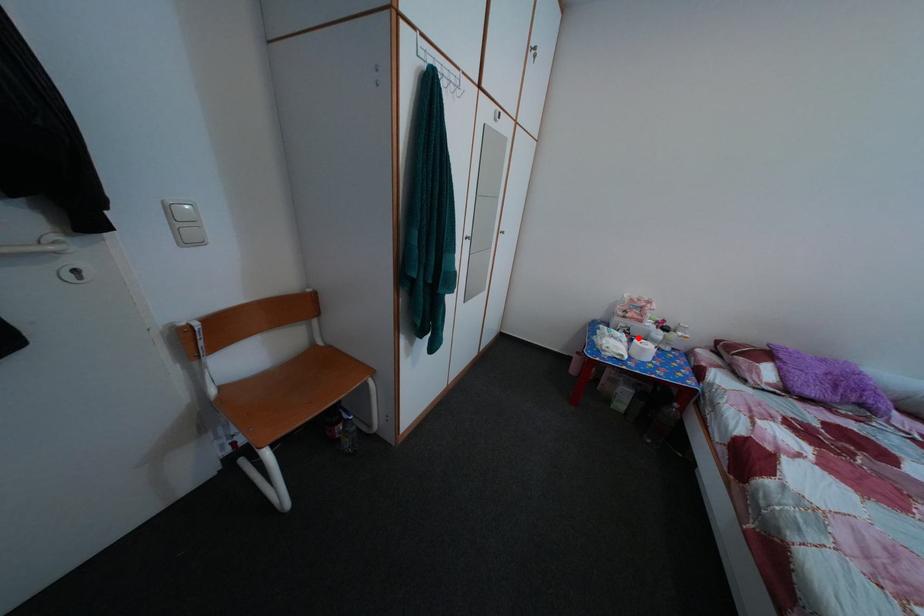
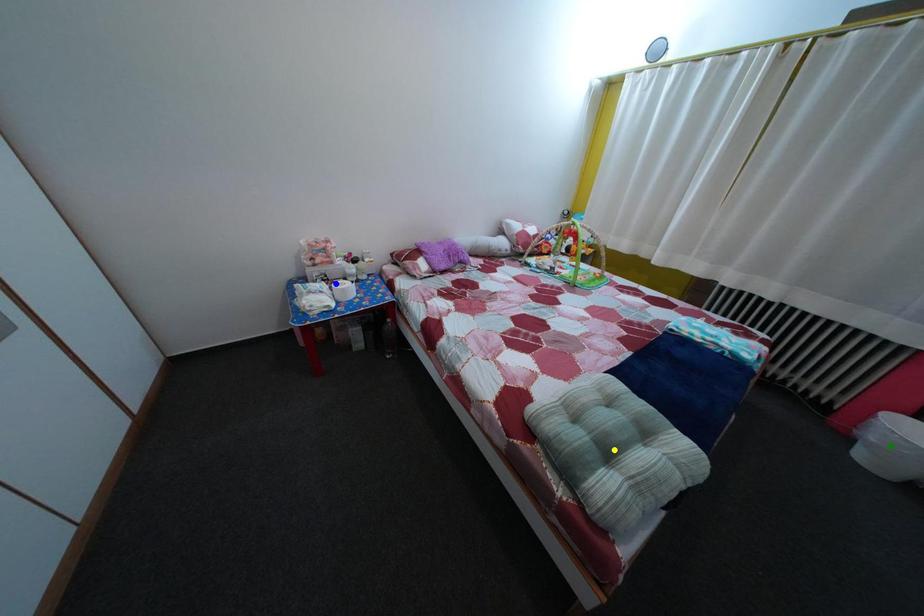
Question: I am providing you with two images of the same scene from different viewpoints. A red point is marked on the first image. You are given multiple points on the second image. Which spot in image 2 lines up with the point in image 1?

Choices:
 (A) yellow point
 (B) blue point
 (C) green point

Answer: (B)